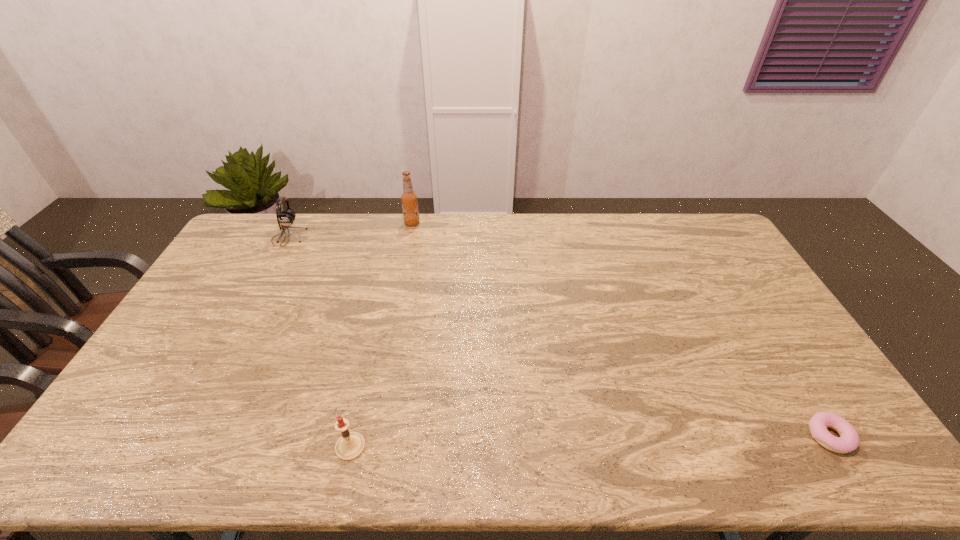
The height and width of the screenshot is (540, 960). I want to click on vacant space located 0.070m on the left of the rightmost object, so click(780, 436).

At what (x,y) coordinates should I click in order to perform the action: click on beer bottle located in the far edge section of the desktop. Please return your answer as a coordinate pair (x, y). Looking at the image, I should click on (409, 199).

Image resolution: width=960 pixels, height=540 pixels. What are the coordinates of `earphone present at the far edge` in the screenshot? It's located at (286, 217).

The height and width of the screenshot is (540, 960). Find the location of `candle situated at the near edge`. candle situated at the near edge is located at coordinates (350, 445).

This screenshot has height=540, width=960. Find the location of `doughnut positioned at the near edge`. doughnut positioned at the near edge is located at coordinates (849, 440).

Find the location of a particular element. object that is at the left edge is located at coordinates (286, 217).

At what (x,y) coordinates should I click in order to perform the action: click on object situated at the right edge. Please return your answer as a coordinate pair (x, y). Looking at the image, I should click on (849, 440).

Where is `object that is at the far left corner`? This screenshot has height=540, width=960. object that is at the far left corner is located at coordinates (286, 217).

The width and height of the screenshot is (960, 540). Identify the location of object located in the near right corner section of the desktop. (849, 440).

Where is `free space at the far edge`? This screenshot has height=540, width=960. free space at the far edge is located at coordinates (648, 243).